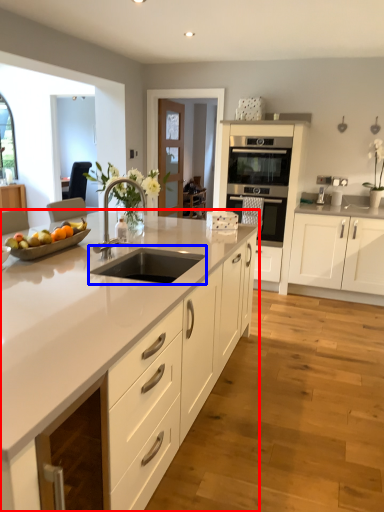
Question: Which object appears farthest to the camera in this image, cabinetry (highlighted by a red box) or sink (highlighted by a blue box)?

Choices:
 (A) cabinetry
 (B) sink

Answer: (B)